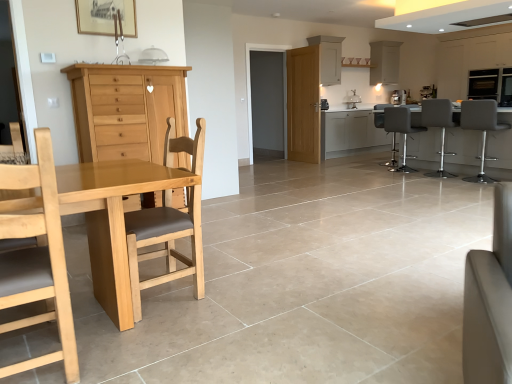
Question: From a real-world perspective, relative to white leather couch at lower right, is matte white cabinet at upper right, which is the second cabinetry in front-to-back order, vertically above or below?

Choices:
 (A) below
 (B) above

Answer: (B)

Question: In the image, is matte white cabinet at upper right, which is the second cabinetry in front-to-back order, positioned in front of or behind white leather couch at lower right?

Choices:
 (A) behind
 (B) front

Answer: (A)

Question: Which of these objects is positioned farthest from the gray leather bar stool at right, the 3th chair positioned from the front?

Choices:
 (A) matte gray barstools at right
 (B) light brown wood cabinet at left, the first cabinetry from the front
 (C) white leather couch at lower right
 (D) light brown wood table at left
 (E) light brown wood chair at left, which ranks as the 5th chair in right-to-left order

Answer: (D)

Question: Estimate the real-world distances between objects in this image. Which object is farther from the white leather couch at lower right?

Choices:
 (A) matte grey bar stool at right, which ranks as the fifth chair in front-to-back order
 (B) white glossy exhaust hood at upper center
 (C) white glossy cabinet at upper center, which is counted as the second cabinetry, starting from the right
 (D) light brown wood cabinet at left, arranged as the 1th cabinetry when viewed from the left
 (E) wooden picture frame at upper center

Answer: (C)